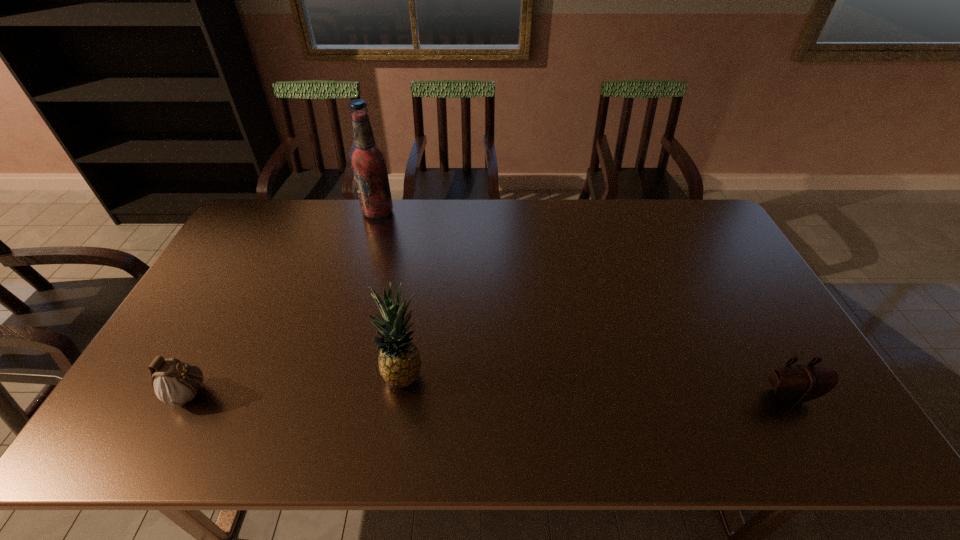
The height and width of the screenshot is (540, 960). Find the location of `object present at the far edge`. object present at the far edge is located at coordinates (368, 162).

Locate an element on the screen. object that is at the left edge is located at coordinates (175, 383).

This screenshot has height=540, width=960. I want to click on object located in the right edge section of the desktop, so click(796, 384).

Locate an element on the screen. The height and width of the screenshot is (540, 960). vacant region at the far edge is located at coordinates (471, 218).

The width and height of the screenshot is (960, 540). What are the coordinates of `vacant space at the near edge of the desktop` in the screenshot? It's located at (578, 424).

Locate an element on the screen. The width and height of the screenshot is (960, 540). vacant region at the right edge of the desktop is located at coordinates (732, 253).

The height and width of the screenshot is (540, 960). Identify the location of free space at the far left corner. (266, 224).

Where is `free space at the far right corner of the desktop`? The image size is (960, 540). free space at the far right corner of the desktop is located at coordinates (683, 201).

At what (x,y) coordinates should I click in order to perform the action: click on blank region between the third shortest object and the left pouch. Please return your answer as a coordinate pair (x, y). The image size is (960, 540). Looking at the image, I should click on (299, 384).

What are the coordinates of `free space between the leftmost object and the rightmost object` in the screenshot? It's located at (491, 395).